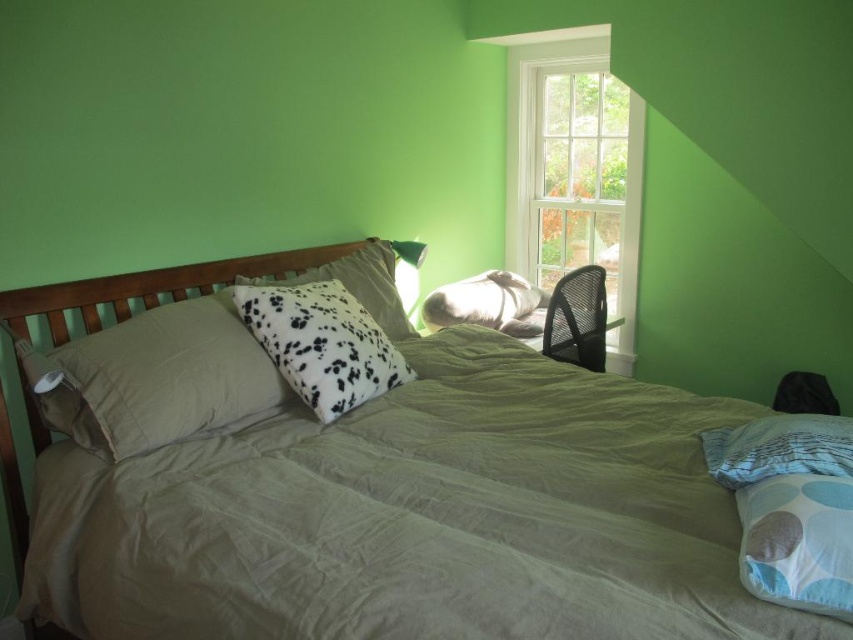
Question: Which of the following is the farthest from the observer?

Choices:
 (A) white dotted pillow at center
 (B) satin beige pillow at left

Answer: (A)

Question: Can you confirm if light blue fabric pillow at lower right is positioned to the left of white dotted pillow at upper center?

Choices:
 (A) yes
 (B) no

Answer: (B)

Question: Does light blue fabric pillow at lower right have a smaller size compared to white dotted pillow at upper center?

Choices:
 (A) no
 (B) yes

Answer: (B)

Question: Does white dotted pillow at center appear under white dotted pillow at upper center?

Choices:
 (A) no
 (B) yes

Answer: (B)

Question: Which point is farther to the camera?

Choices:
 (A) (581, 93)
 (B) (103, 388)
 (C) (582, 381)

Answer: (A)

Question: Among these objects, which one is nearest to the camera?

Choices:
 (A) wooden headboard at upper left
 (B) white dotted pillow at upper center
 (C) white wood window at upper center

Answer: (A)